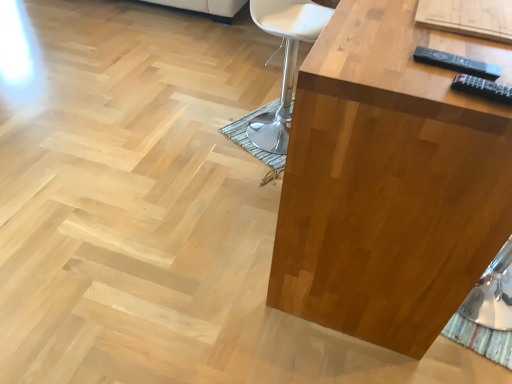
Where is `free space to the back side of black plastic remote at upper right, positioned as the second remote in bottom-to-top order`? free space to the back side of black plastic remote at upper right, positioned as the second remote in bottom-to-top order is located at coordinates (421, 35).